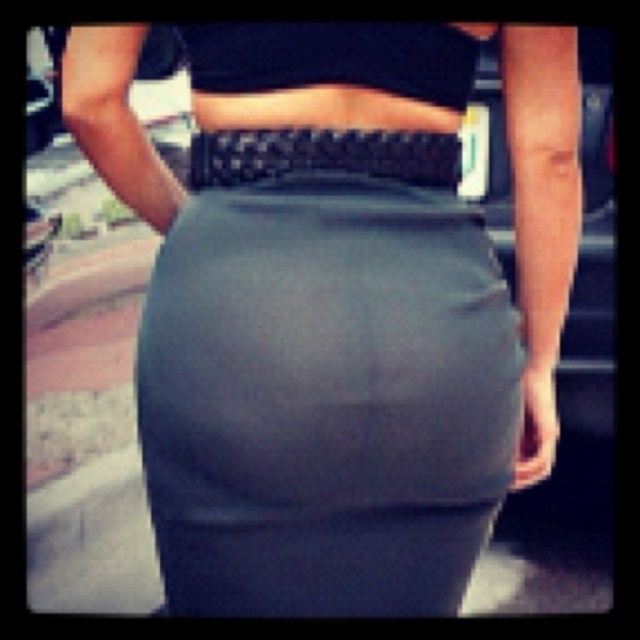
Question: Which point is farther to the camera?

Choices:
 (A) black woven belt at center
 (B) black matte crop top at upper center

Answer: (A)

Question: Which of the following is the farthest from the observer?

Choices:
 (A) black matte crop top at upper center
 (B) black woven belt at center

Answer: (B)

Question: Is black matte crop top at upper center above black woven belt at center?

Choices:
 (A) yes
 (B) no

Answer: (A)

Question: Can you confirm if black matte crop top at upper center is bigger than black woven belt at center?

Choices:
 (A) yes
 (B) no

Answer: (B)

Question: Observing the image, what is the correct spatial positioning of black matte crop top at upper center in reference to black woven belt at center?

Choices:
 (A) above
 (B) below

Answer: (A)

Question: Which object appears closest to the camera in this image?

Choices:
 (A) black matte crop top at upper center
 (B) black woven belt at center

Answer: (A)